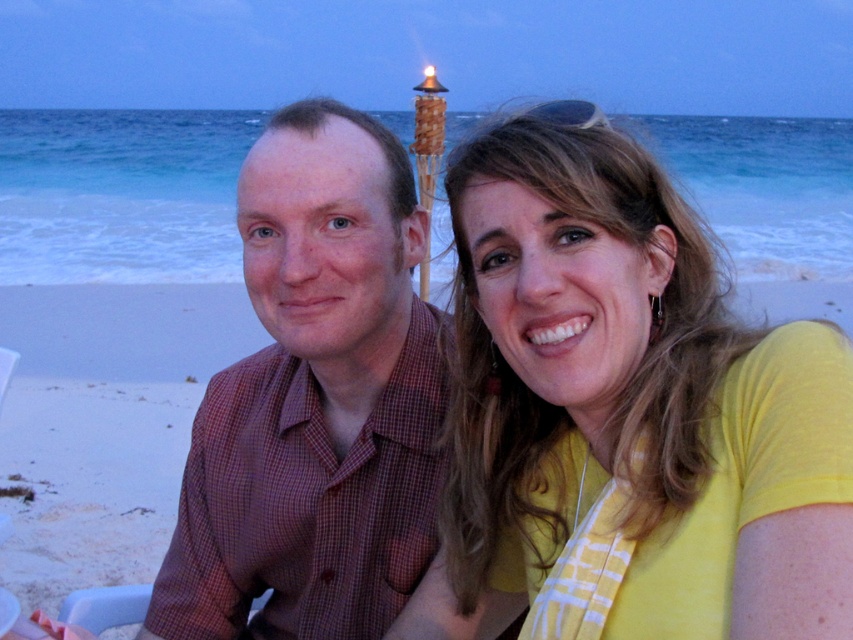
Question: Can you confirm if yellow fabric at upper right is positioned above plaid shirt at center?

Choices:
 (A) yes
 (B) no

Answer: (A)

Question: Which object appears closest to the camera in this image?

Choices:
 (A) plaid shirt at center
 (B) yellow fabric at upper right

Answer: (B)

Question: Can you confirm if yellow fabric at upper right is smaller than plaid shirt at center?

Choices:
 (A) no
 (B) yes

Answer: (B)

Question: Observing the image, what is the correct spatial positioning of yellow fabric at upper right in reference to plaid shirt at center?

Choices:
 (A) below
 (B) above

Answer: (B)

Question: Which object is closer to the camera taking this photo?

Choices:
 (A) yellow fabric at upper right
 (B) plaid shirt at center

Answer: (A)

Question: Which point is farther from the camera taking this photo?

Choices:
 (A) (509, 310)
 (B) (287, 224)

Answer: (B)